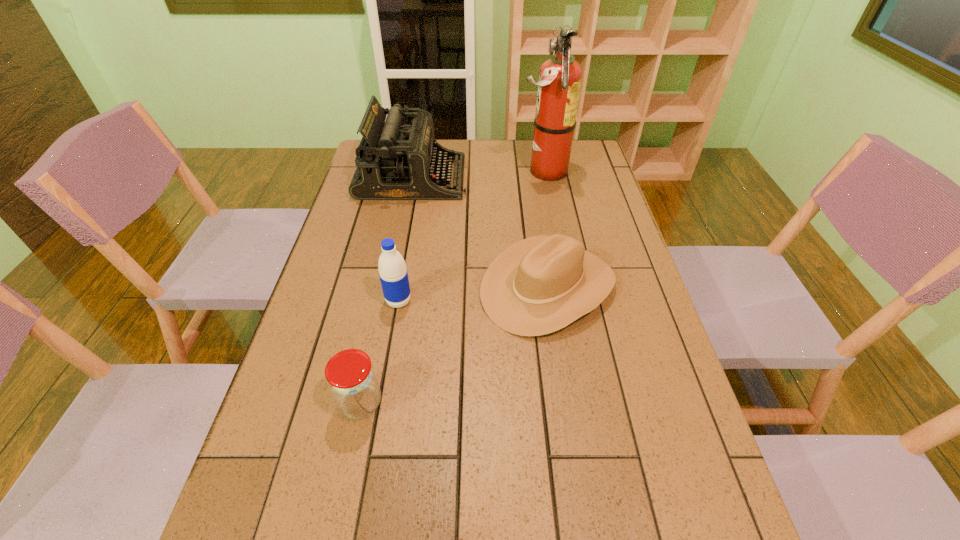
At what (x,y) coordinates should I click in order to perform the action: click on free location at the far edge of the desktop. Please return your answer as a coordinate pair (x, y). Image resolution: width=960 pixels, height=540 pixels. Looking at the image, I should click on (485, 167).

At what (x,y) coordinates should I click in order to perform the action: click on vacant space at the right edge. Please return your answer as a coordinate pair (x, y). Looking at the image, I should click on (573, 210).

Image resolution: width=960 pixels, height=540 pixels. In the image, there is a desktop. What are the coordinates of `free space at the far right corner` in the screenshot? It's located at (588, 150).

This screenshot has height=540, width=960. Find the location of `vacant area between the tallest object and the nearest object`. vacant area between the tallest object and the nearest object is located at coordinates (452, 287).

Locate an element on the screen. The width and height of the screenshot is (960, 540). vacant area that lies between the cowboy hat and the typewriter is located at coordinates (480, 232).

Identify the location of vacant point located between the cowboy hat and the nearest object. 454,345.

This screenshot has width=960, height=540. I want to click on unoccupied position between the nearest object and the cowboy hat, so click(x=454, y=345).

This screenshot has height=540, width=960. I want to click on vacant area between the water bottle and the cowboy hat, so click(473, 294).

You are a GUI agent. You are given a task and a screenshot of the screen. Output one action in this format:
    pyautogui.click(x=<x>, y=<y>)
    Task: Click on the object that stands as the second closest to the fourth shortest object
    This screenshot has width=960, height=540.
    Given the screenshot: What is the action you would take?
    pyautogui.click(x=541, y=284)

You are a GUI agent. You are given a task and a screenshot of the screen. Output one action in this format:
    pyautogui.click(x=<x>, y=<y>)
    Task: Click on the fourth closest object to the fire extinguisher
    
    Given the screenshot: What is the action you would take?
    pyautogui.click(x=352, y=381)